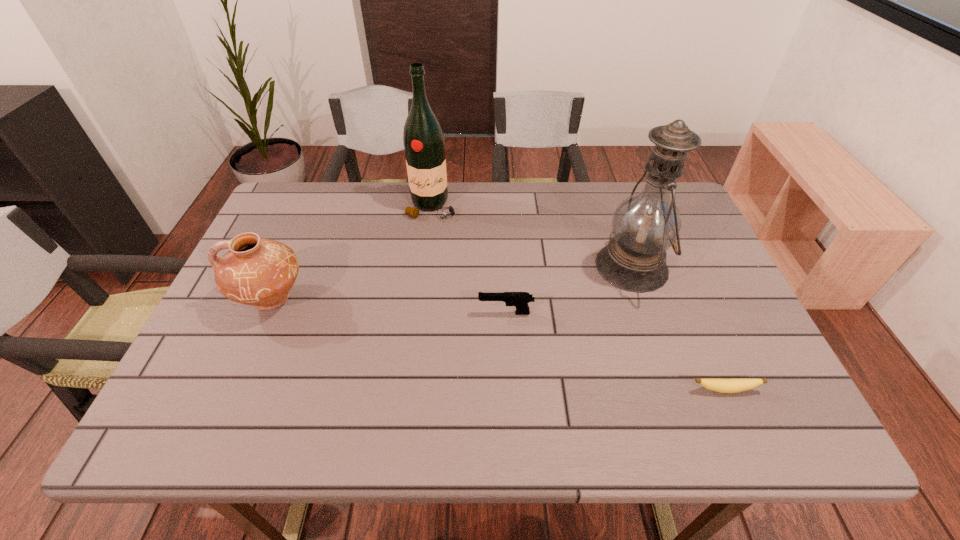
Identify the location of free space between the third object from right to left and the third shortest object. (389, 306).

Locate an element on the screen. This screenshot has width=960, height=540. free area in between the banana and the oil lamp is located at coordinates (678, 328).

Where is `vacant point located between the pottery and the oil lamp`? vacant point located between the pottery and the oil lamp is located at coordinates (451, 282).

Find the location of a particular element. The width and height of the screenshot is (960, 540). free space between the oil lamp and the leftmost object is located at coordinates (451, 282).

You are a GUI agent. You are given a task and a screenshot of the screen. Output one action in this format:
    pyautogui.click(x=<x>, y=<y>)
    Task: Click on the empty location between the oil lamp and the third shortest object
    
    Given the screenshot: What is the action you would take?
    pyautogui.click(x=451, y=282)

This screenshot has width=960, height=540. I want to click on blank region between the wine bottle and the leftmost object, so click(x=351, y=253).

Where is `object that stands as the closest to the shortest object`? object that stands as the closest to the shortest object is located at coordinates (645, 225).

Select which object appears as the third closest to the nearest object. Please provide its 2D coordinates. Your answer should be formatted as a tuple, i.e. [(x, y)], where the tuple contains the x and y coordinates of a point satisfying the conditions above.

[(424, 145)]

In order to click on vacant area that satisfies the following two spatial constraints: 1. on the side of the third tallest object with the handle; 2. on the left side of the oil lamp in this screenshot , I will do `click(286, 266)`.

This screenshot has height=540, width=960. Identify the location of free spot that satisfies the following two spatial constraints: 1. on the surface of the farthest object; 2. on the left side of the nearest object. (409, 389).